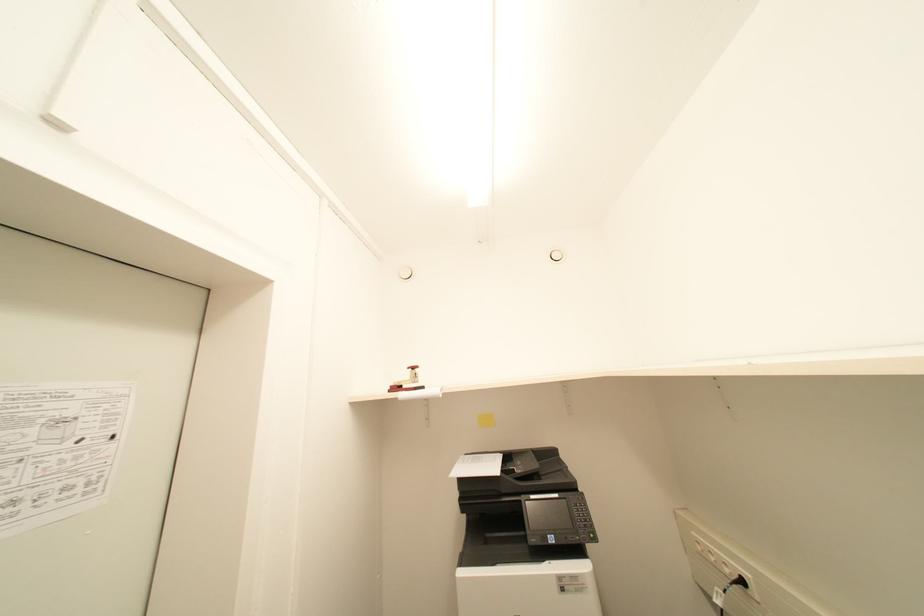
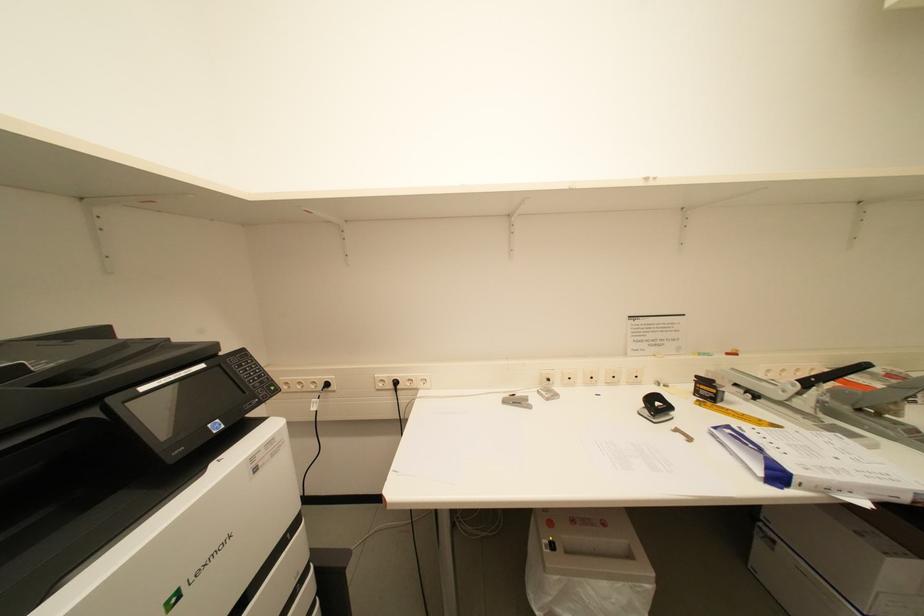
Question: The camera is either moving clockwise (left) or counter-clockwise (right) around the object. The first image is from the beginning of the video and the second image is from the end. Is the camera moving left or right when shooting the video?

Choices:
 (A) Left
 (B) Right

Answer: (A)